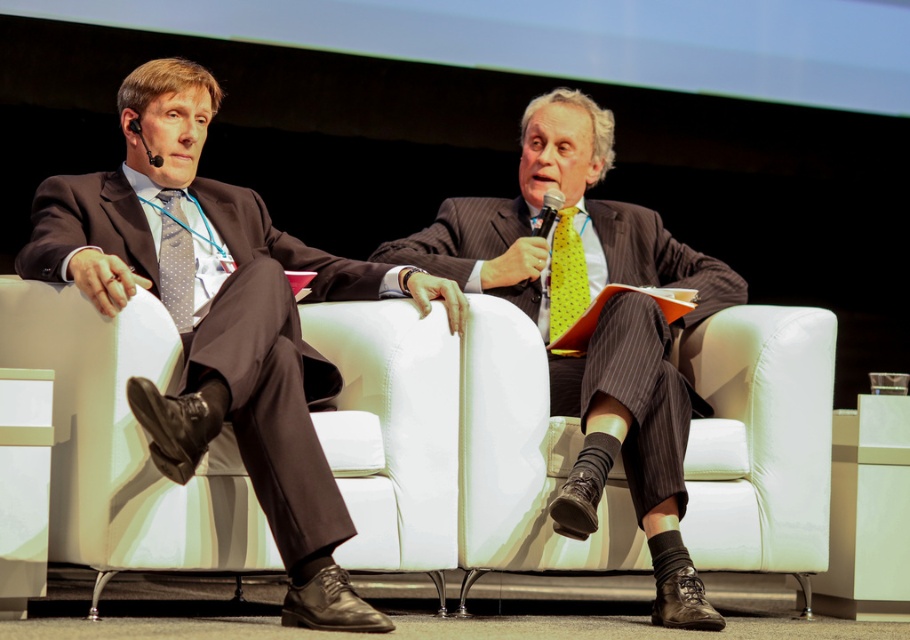
Question: Which point is closer to the camera?

Choices:
 (A) (154, 266)
 (B) (688, 358)
 (C) (158, 252)

Answer: (A)

Question: Which is nearer to the matte black suit at center?

Choices:
 (A) matte black suit at left
 (B) matte gray tie at left

Answer: (A)

Question: Is yellow dotted fabric tie at center bigger than matte gray tie at left?

Choices:
 (A) yes
 (B) no

Answer: (A)

Question: Can you confirm if matte black suit at center is thinner than matte gray tie at left?

Choices:
 (A) no
 (B) yes

Answer: (A)

Question: Is matte black suit at left closer to camera compared to matte black suit at center?

Choices:
 (A) yes
 (B) no

Answer: (A)

Question: Which point is closer to the camera?

Choices:
 (A) matte black suit at center
 (B) matte gray tie at left
 (C) yellow dotted fabric tie at center

Answer: (A)